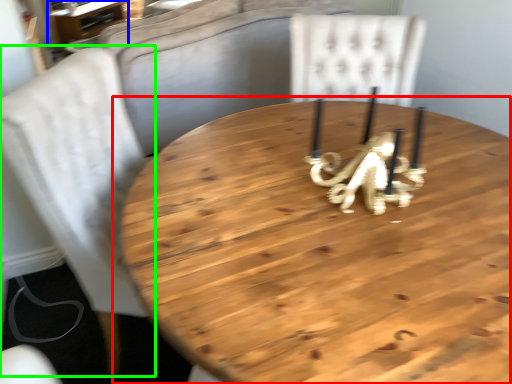
Question: Considering the real-world distances, which object is farthest from table (highlighted by a red box)? table (highlighted by a blue box) or chair (highlighted by a green box)?

Choices:
 (A) table
 (B) chair

Answer: (A)